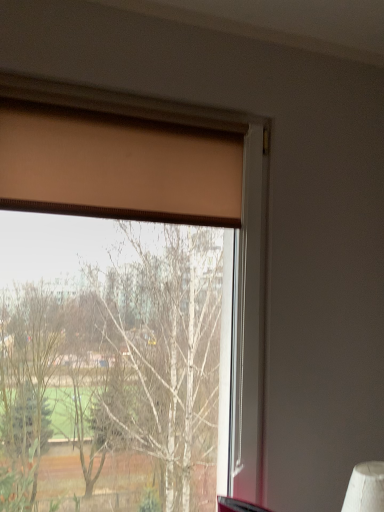
Where is `matte brown curtain at upper left`? Image resolution: width=384 pixels, height=512 pixels. matte brown curtain at upper left is located at coordinates (123, 156).

What do you see at coordinates (123, 156) in the screenshot?
I see `matte brown curtain at upper left` at bounding box center [123, 156].

You are a GUI agent. You are given a task and a screenshot of the screen. Output one action in this format:
    pyautogui.click(x=<x>, y=<y>)
    Task: Click on the matte brown curtain at upper left
    
    Given the screenshot: What is the action you would take?
    pyautogui.click(x=117, y=168)

Measure the distance between point (12,184) and camera.

A distance of 1.12 meters exists between point (12,184) and camera.

What do you see at coordinates (117, 168) in the screenshot? I see `matte brown curtain at upper left` at bounding box center [117, 168].

Measure the distance between matte brown curtain at upper left and camera.

matte brown curtain at upper left is 3.63 feet away from camera.

This screenshot has height=512, width=384. I want to click on matte brown curtain at upper left, so click(x=123, y=156).

Between matte brown curtain at upper left and matte brown curtain at upper left, which one appears on the left side from the viewer's perspective?

matte brown curtain at upper left is more to the left.

Is matte brown curtain at upper left closer to camera compared to matte brown curtain at upper left?

That is True.

Between point (237, 164) and point (164, 168), which one is positioned in front?

Positioned in front is point (164, 168).

From the image's perspective, does matte brown curtain at upper left appear higher than matte brown curtain at upper left?

Incorrect, from the image's perspective, matte brown curtain at upper left is lower than matte brown curtain at upper left.

From a real-world perspective, which is physically above, matte brown curtain at upper left or matte brown curtain at upper left?

In real-world perspective, matte brown curtain at upper left is above.

In the scene shown: Is matte brown curtain at upper left wider or thinner than matte brown curtain at upper left?

Considering their sizes, matte brown curtain at upper left looks broader than matte brown curtain at upper left.

Does matte brown curtain at upper left have a greater height compared to matte brown curtain at upper left?

Indeed, matte brown curtain at upper left has a greater height compared to matte brown curtain at upper left.

Considering the relative sizes of matte brown curtain at upper left and matte brown curtain at upper left in the image provided, is matte brown curtain at upper left smaller than matte brown curtain at upper left?

No, matte brown curtain at upper left is not smaller than matte brown curtain at upper left.

Is matte brown curtain at upper left not within matte brown curtain at upper left?

Indeed, matte brown curtain at upper left is completely outside matte brown curtain at upper left.

Is matte brown curtain at upper left positioned far away from matte brown curtain at upper left?

No.

Is matte brown curtain at upper left positioned with its back to matte brown curtain at upper left?

That's right, matte brown curtain at upper left is facing away from matte brown curtain at upper left.

How different are the orientations of matte brown curtain at upper left and matte brown curtain at upper left in degrees?

0.52 degrees separate the facing orientations of matte brown curtain at upper left and matte brown curtain at upper left.

In order to click on window that is under the matte brown curtain at upper left (from a real-world perspective) in this screenshot , I will do `click(123, 156)`.

In the image, is matte brown curtain at upper left on the left side or the right side of matte brown curtain at upper left?

From the image, it's evident that matte brown curtain at upper left is to the left of matte brown curtain at upper left.

Is matte brown curtain at upper left in front of matte brown curtain at upper left?

No, matte brown curtain at upper left is further to the viewer.

Which is behind, point (217, 183) or point (175, 116)?

Positioned behind is point (217, 183).

From the image's perspective, is matte brown curtain at upper left positioned above or below matte brown curtain at upper left?

Clearly, from the image's perspective, matte brown curtain at upper left is above matte brown curtain at upper left.

From a real-world perspective, which is physically below, matte brown curtain at upper left or matte brown curtain at upper left?

matte brown curtain at upper left is physically lower.

Does matte brown curtain at upper left have a greater width compared to matte brown curtain at upper left?

No.

Is matte brown curtain at upper left taller or shorter than matte brown curtain at upper left?

matte brown curtain at upper left is shorter than matte brown curtain at upper left.

Can you confirm if matte brown curtain at upper left is bigger than matte brown curtain at upper left?

Incorrect, matte brown curtain at upper left is not larger than matte brown curtain at upper left.

Is matte brown curtain at upper left inside matte brown curtain at upper left?

No, matte brown curtain at upper left is not a part of matte brown curtain at upper left.

Is the surface of matte brown curtain at upper left in direct contact with matte brown curtain at upper left?

Yes, the surface of matte brown curtain at upper left is in contact with matte brown curtain at upper left.

Based on the photo, could you tell me if matte brown curtain at upper left is turned towards matte brown curtain at upper left?

Yes.

This screenshot has height=512, width=384. What are the coordinates of `window in front of the matte brown curtain at upper left` in the screenshot? It's located at (123, 156).

Identify the location of curtain located above the matte brown curtain at upper left (from the image's perspective). Image resolution: width=384 pixels, height=512 pixels. (117, 168).

The height and width of the screenshot is (512, 384). I want to click on curtain on the left of matte brown curtain at upper left, so click(x=117, y=168).